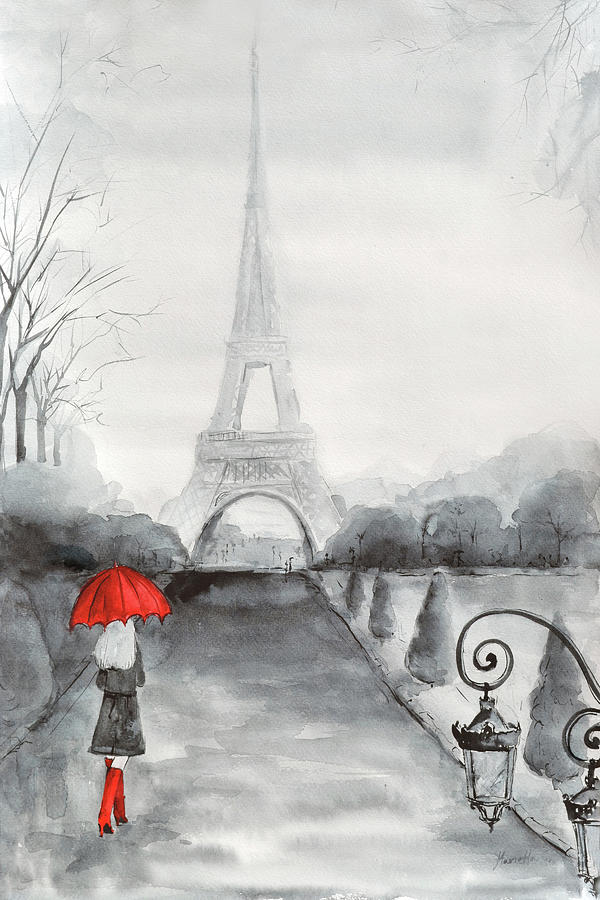
Find the location of a particular element. painting of paris is located at coordinates point(311,619).